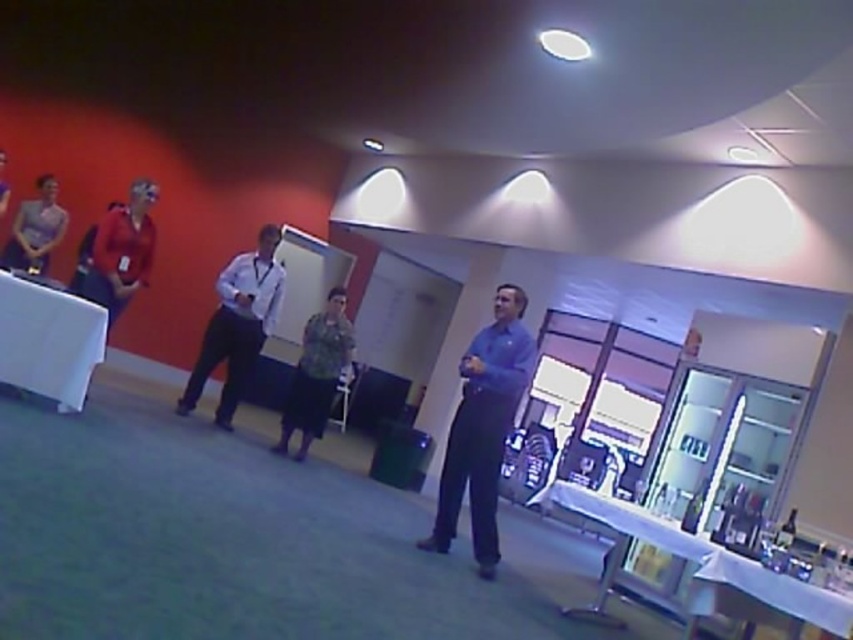
You are standing in the conference room and notice two points marked on the whiteboard. The first point is at coordinates point (15, 285) and the second is at point (274, 273). Which point is closer to you?

Point (15, 285) is closer to the viewer than point (274, 273).

You are in a conference room and need to place a laptop on the white fabric table at left. Based on its position, can you confirm if the table is near the whiteboard where the group is gathered?

The white fabric table at left is located at point (48, 340), which suggests it is positioned near the whiteboard where the group is gathered.

You are standing in the conference room and see two points marked on the whiteboard. The points are labeled as point (x=509, y=429) and point (x=260, y=273). Which point is closer to you?

Point (x=509, y=429) is closer to the viewer than point (x=260, y=273).